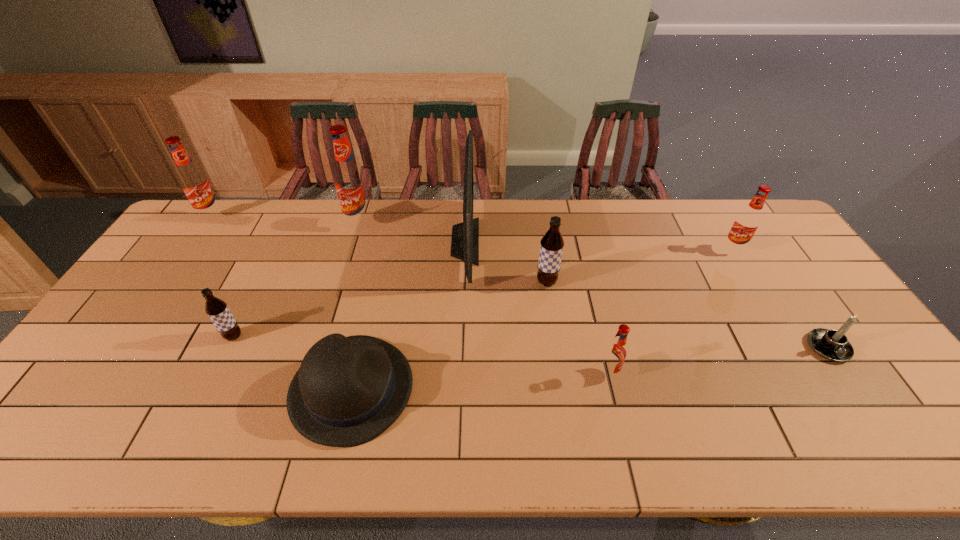
Locate an element on the screen. free space between the second nearest root beer and the biggest red root beer is located at coordinates (297, 280).

Where is `empty location between the nearest red root beer and the left brown root beer`? empty location between the nearest red root beer and the left brown root beer is located at coordinates (421, 355).

The width and height of the screenshot is (960, 540). I want to click on vacant area between the rightmost object and the bowler hat, so click(x=589, y=368).

The height and width of the screenshot is (540, 960). I want to click on free space that is in between the second smallest red root beer and the second root beer from left to right, so click(484, 293).

Find the location of a particular element. The width and height of the screenshot is (960, 540). empty space that is in between the black monitor and the candle holder is located at coordinates (646, 295).

Locate which object ranks third in proximity to the bigger brown root beer. Please provide its 2D coordinates. Your answer should be formatted as a tuple, i.e. [(x, y)], where the tuple contains the x and y coordinates of a point satisfying the conditions above.

[(348, 390)]

Where is `the sixth closest object to the bowler hat`? The height and width of the screenshot is (540, 960). the sixth closest object to the bowler hat is located at coordinates (195, 184).

I want to click on root beer that is the third closest to the bowler hat, so click(x=350, y=182).

In order to click on the second closest root beer to the rightmost object in this screenshot , I will do `click(615, 353)`.

The image size is (960, 540). Identify the location of the second closest red root beer to the second root beer from left to right. (195, 184).